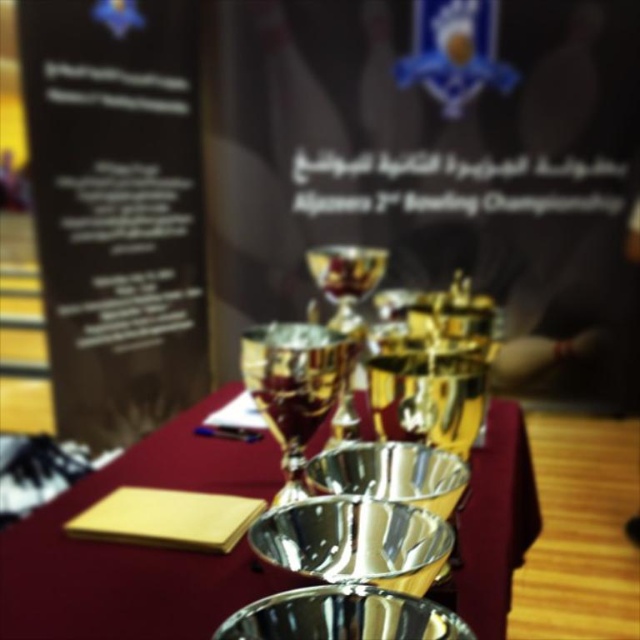
Question: Considering the relative positions of black paper at left and silver metallic bowls at center in the image provided, where is black paper at left located with respect to silver metallic bowls at center?

Choices:
 (A) left
 (B) right

Answer: (A)

Question: Is black paper at left to the right of silver metallic bowls at center from the viewer's perspective?

Choices:
 (A) no
 (B) yes

Answer: (A)

Question: Which point is farther to the camera?

Choices:
 (A) black paper at left
 (B) silver metallic bowls at center

Answer: (A)

Question: Considering the relative positions of black paper at left and silver metallic bowls at center in the image provided, where is black paper at left located with respect to silver metallic bowls at center?

Choices:
 (A) left
 (B) right

Answer: (A)